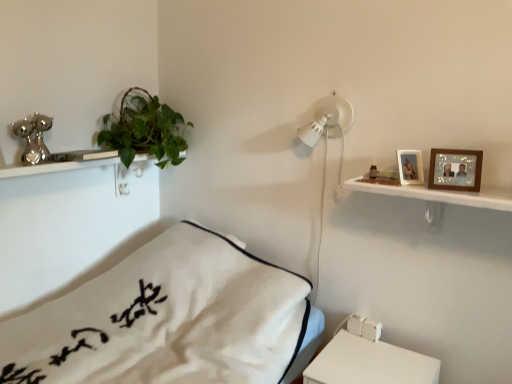
Question: Should I look upward or downward to see wooden photo frame at upper right, marked as the 2th picture frame in a right-to-left arrangement?

Choices:
 (A) down
 (B) up

Answer: (B)

Question: Considering the relative sizes of wooden photo frame at upper right, positioned as the second picture frame in front-to-back order, and white matte table at lower right in the image provided, is wooden photo frame at upper right, positioned as the second picture frame in front-to-back order, smaller than white matte table at lower right?

Choices:
 (A) yes
 (B) no

Answer: (A)

Question: Is wooden photo frame at upper right, marked as the 2th picture frame in a right-to-left arrangement, further to camera compared to white matte table at lower right?

Choices:
 (A) no
 (B) yes

Answer: (B)

Question: Is wooden photo frame at upper right, marked as the 2th picture frame in a right-to-left arrangement, oriented towards white matte table at lower right?

Choices:
 (A) yes
 (B) no

Answer: (B)

Question: Considering the relative positions of wooden photo frame at upper right, positioned as the second picture frame in front-to-back order, and white matte table at lower right in the image provided, is wooden photo frame at upper right, positioned as the second picture frame in front-to-back order, to the right of white matte table at lower right from the viewer's perspective?

Choices:
 (A) yes
 (B) no

Answer: (A)

Question: Is wooden photo frame at upper right, marked as the 2th picture frame in a right-to-left arrangement, positioned before white matte table at lower right?

Choices:
 (A) no
 (B) yes

Answer: (A)

Question: Is white matte table at lower right at the back of wooden photo frame at upper right, marked as the 2th picture frame in a right-to-left arrangement?

Choices:
 (A) no
 (B) yes

Answer: (A)

Question: Is wooden picture frame at upper right, placed as the 1th picture frame when sorted from right to left, positioned beyond the bounds of white cotton bed at center?

Choices:
 (A) no
 (B) yes

Answer: (B)

Question: From a real-world perspective, does wooden picture frame at upper right, the 1th picture frame viewed from the front, stand above white cotton bed at center?

Choices:
 (A) yes
 (B) no

Answer: (A)

Question: Can you confirm if wooden picture frame at upper right, the 1th picture frame viewed from the front, is shorter than white cotton bed at center?

Choices:
 (A) yes
 (B) no

Answer: (A)

Question: From the image's perspective, is wooden picture frame at upper right, acting as the 2th picture frame starting from the left, below white cotton bed at center?

Choices:
 (A) no
 (B) yes

Answer: (A)

Question: Considering the relative sizes of wooden picture frame at upper right, the 1th picture frame viewed from the front, and white cotton bed at center in the image provided, is wooden picture frame at upper right, the 1th picture frame viewed from the front, smaller than white cotton bed at center?

Choices:
 (A) yes
 (B) no

Answer: (A)

Question: Is wooden picture frame at upper right, placed as the 1th picture frame when sorted from right to left, placed right next to white cotton bed at center?

Choices:
 (A) yes
 (B) no

Answer: (B)

Question: From the image's perspective, is wooden picture frame at upper right, arranged as the second picture frame when viewed from the back, on green leafy plant at upper left?

Choices:
 (A) yes
 (B) no

Answer: (B)